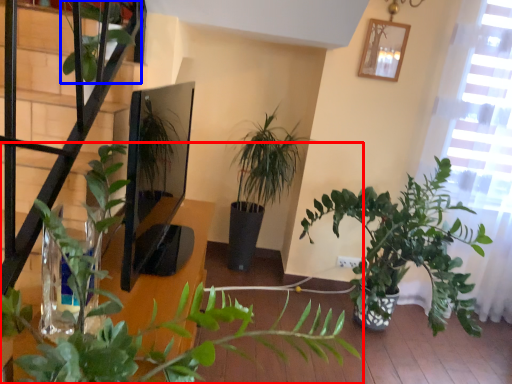
Question: Which object is further to the camera taking this photo, houseplant (highlighted by a red box) or vegetation (highlighted by a blue box)?

Choices:
 (A) houseplant
 (B) vegetation

Answer: (B)